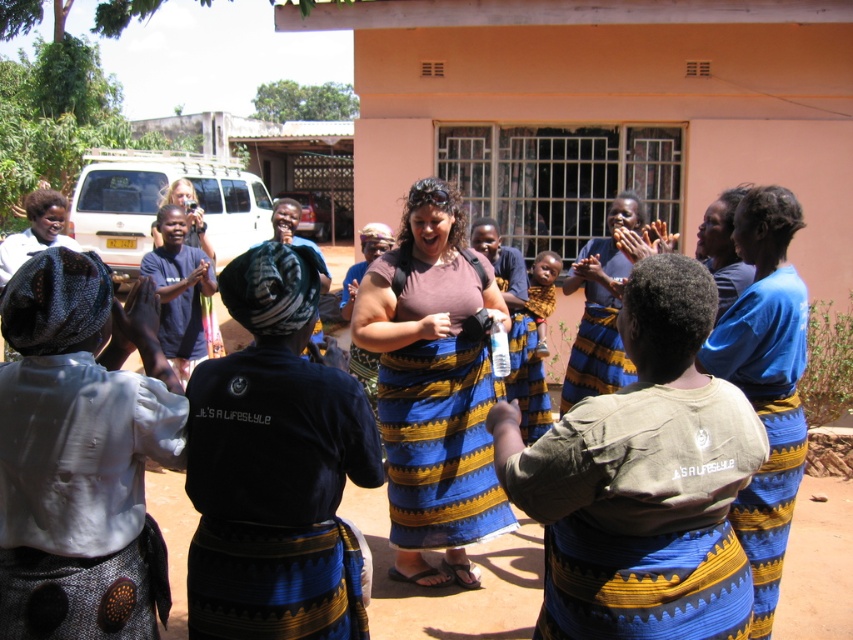
You are standing in the rural setting in front of the peach building. You see two points marked in the scene. Which point is closer to you, point (712,346) or point (618,380)?

Point (712,346) is closer to the viewer than point (618,380).

Looking at this image, you are a photographer trying to capture a candid shot of the people at the gathering. You notice the white cotton shirt at center and the blue striped skirt at center. Which clothing item is shorter in length?

The white cotton shirt at center is shorter than the blue striped skirt at center.

You are organizing a cultural event and need to ensure that all attire fits properly. You have a white cotton shirt at center and a blue striped skirt at center. Which piece of clothing is more likely to need adjustments for a larger size?

The white cotton shirt at center has a smaller size compared to the blue striped skirt at center, so the white cotton shirt at center would need adjustments for a larger size.